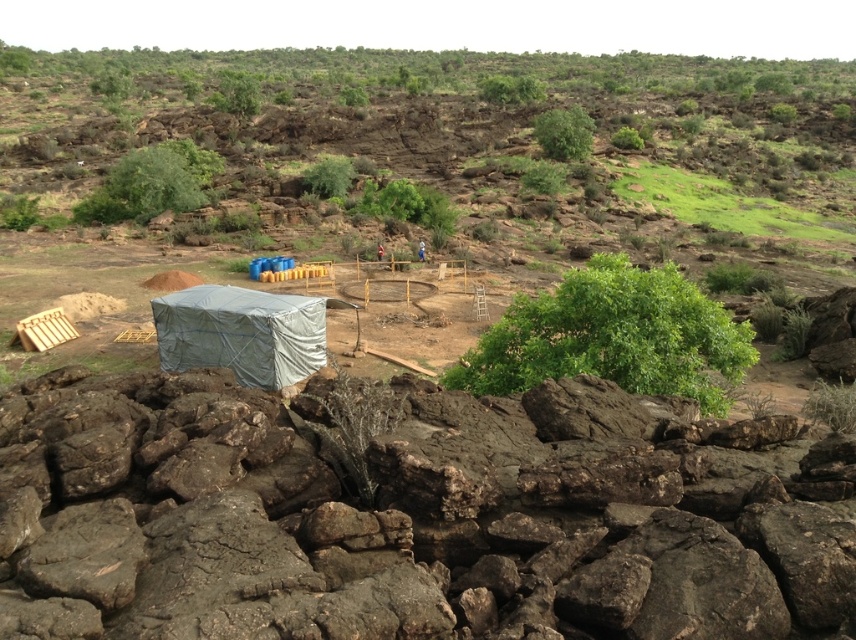
Is green grassy hillside at upper center taller than gray tarp at center?

Indeed, green grassy hillside at upper center has a greater height compared to gray tarp at center.

Which of these two, green grassy hillside at upper center or gray tarp at center, stands taller?

Standing taller between the two is green grassy hillside at upper center.

Between point (565, 90) and point (183, 339), which one is positioned in front?

Point (183, 339) is in front.

At what (x,y) coordinates should I click in order to perform the action: click on green grassy hillside at upper center. Please return your answer as a coordinate pair (x, y). The height and width of the screenshot is (640, 856). Looking at the image, I should click on 453,129.